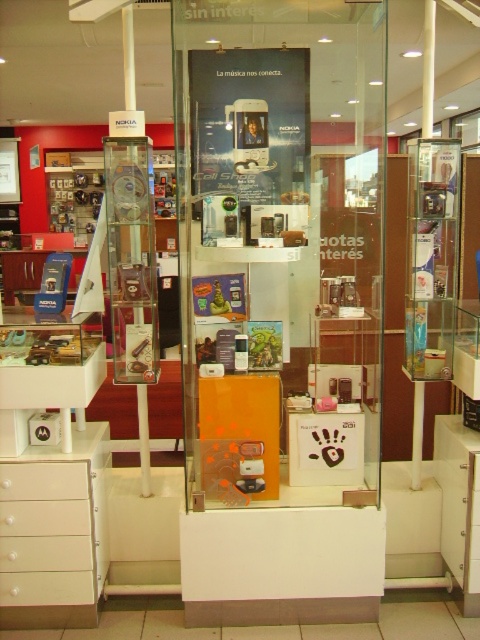
Can you confirm if transparent glass display case at center is thinner than white matte drawer at lower left?

In fact, transparent glass display case at center might be wider than white matte drawer at lower left.

Is transparent glass display case at center to the left of white matte drawer at lower left from the viewer's perspective?

No, transparent glass display case at center is not to the left of white matte drawer at lower left.

Describe the element at coordinates (280, 248) in the screenshot. The width and height of the screenshot is (480, 640). I see `transparent glass display case at center` at that location.

I want to click on transparent glass display case at center, so click(280, 248).

Between transparent glass display case at center and white plastic drawer at lower left, which one appears on the left side from the viewer's perspective?

Positioned to the left is white plastic drawer at lower left.

Locate an element on the screen. transparent glass display case at center is located at coordinates (280, 248).

Locate an element on the screen. transparent glass display case at center is located at coordinates (280, 248).

The height and width of the screenshot is (640, 480). Identify the location of white plastic drawer at lower left. (47, 534).

Between white plastic drawer at lower left and white matte drawer at lower left, which one is positioned lower?

white plastic drawer at lower left is lower down.

At what (x,y) coordinates should I click in order to perform the action: click on white plastic drawer at lower left. Please return your answer as a coordinate pair (x, y). Looking at the image, I should click on (47, 534).